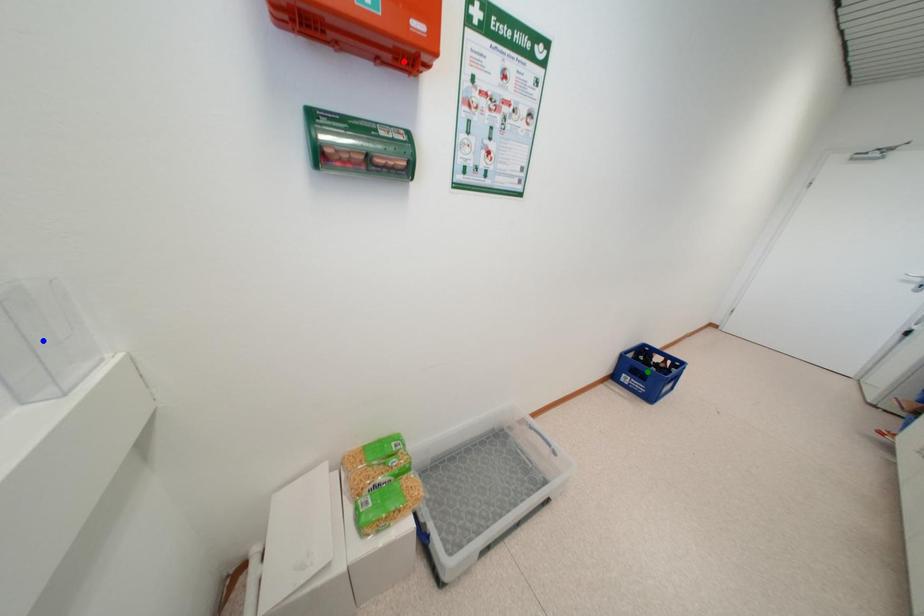
Order these from nearest to farthest:
green point
blue point
red point

blue point, red point, green point